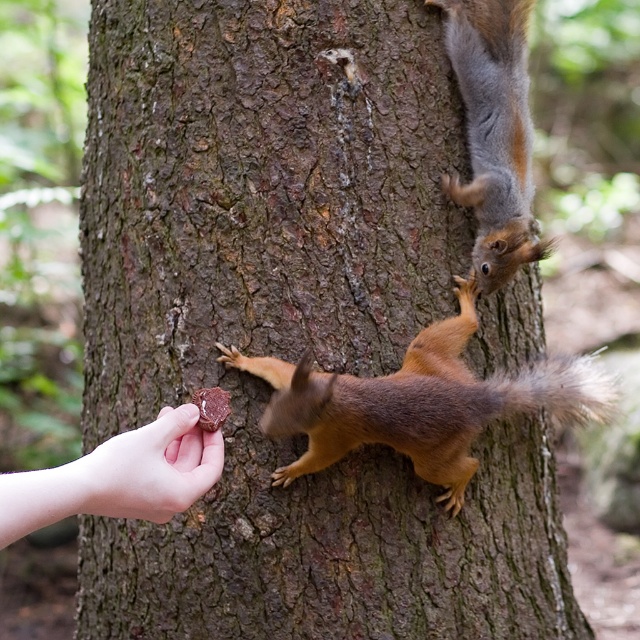
Between point (424, 364) and point (134, 490), which one is positioned behind?

Point (424, 364)

Image resolution: width=640 pixels, height=640 pixels. I want to click on brown furry squirrel at lower center, so click(x=419, y=403).

In order to click on brown furry squirrel at lower center in this screenshot , I will do `click(419, 403)`.

Looking at this image, is brown furry squirrel at lower center to the right of brown matte food at lower left from the viewer's perspective?

Correct, you'll find brown furry squirrel at lower center to the right of brown matte food at lower left.

The image size is (640, 640). Identify the location of brown furry squirrel at lower center. coord(419,403).

Between smooth skin hand at lower left and brown matte food at lower left, which one is positioned higher?

brown matte food at lower left is higher up.

Can you confirm if smooth skin hand at lower left is bigger than brown matte food at lower left?

Yes, smooth skin hand at lower left is bigger than brown matte food at lower left.

Which is in front, point (164, 484) or point (216, 420)?

Positioned in front is point (164, 484).

I want to click on smooth skin hand at lower left, so click(x=150, y=468).